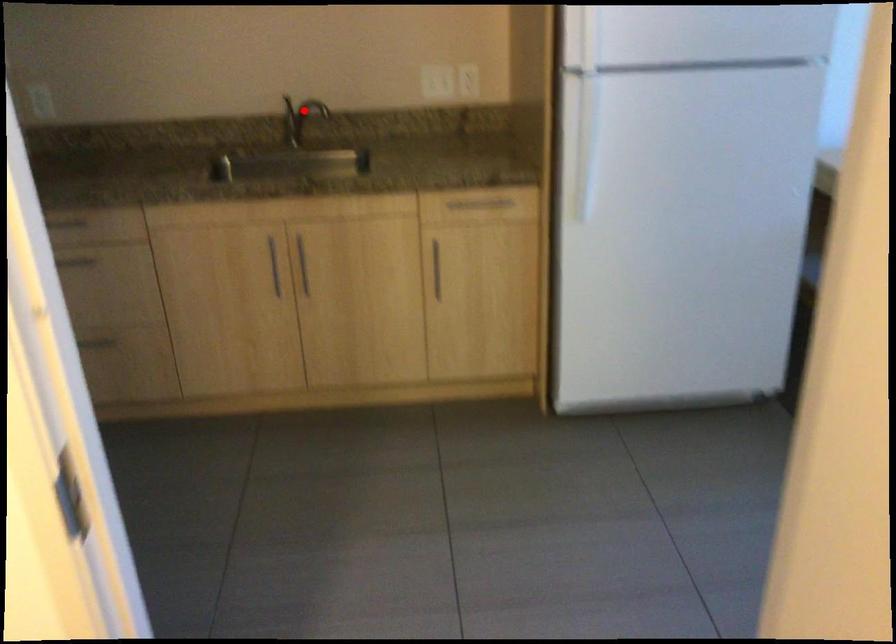
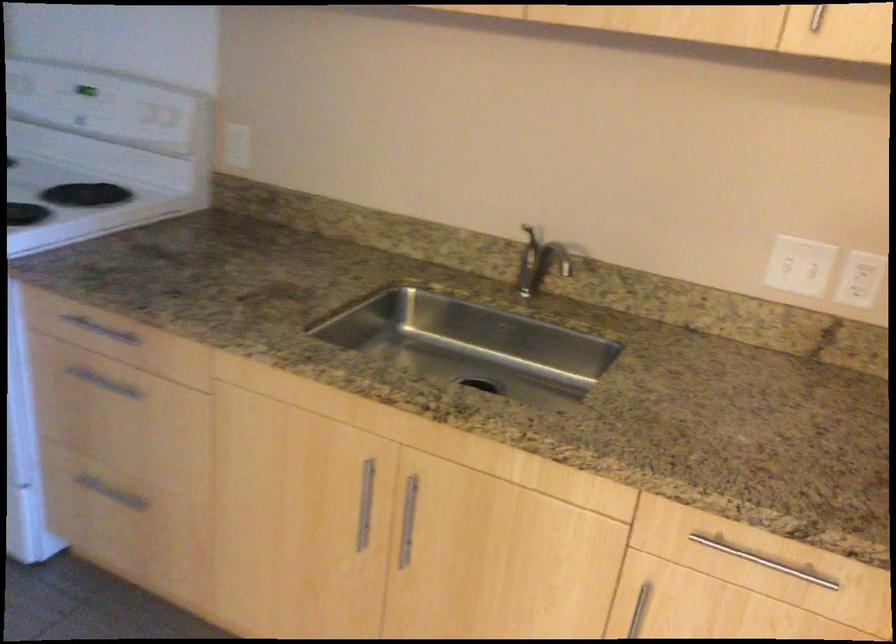
Question: A red point is marked in image1. In image2, is the corresponding 3D point closer to the camera or farther? Reply with the corresponding letter.

Choices:
 (A) The corresponding 3D point is closer.
 (B) The corresponding 3D point is farther.

Answer: (A)